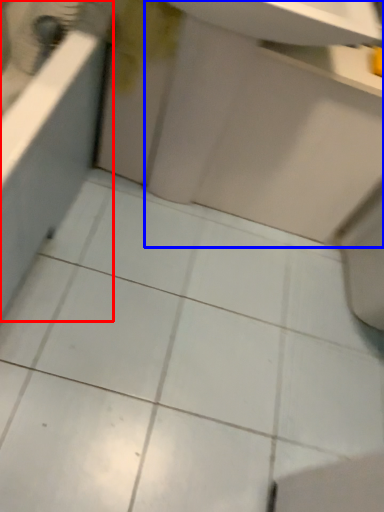
Question: Which point is further to the camera, bath (highlighted by a red box) or sink (highlighted by a blue box)?

Choices:
 (A) bath
 (B) sink

Answer: (B)